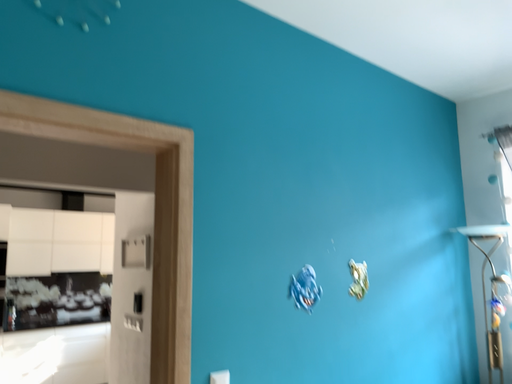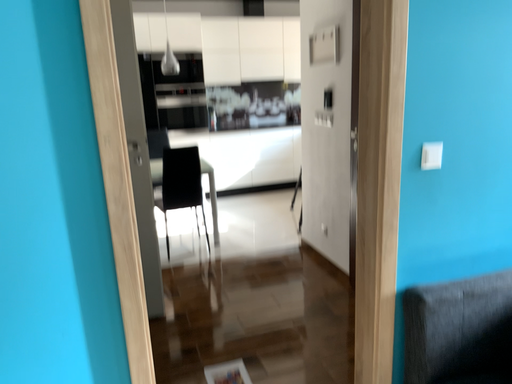
Question: Which way did the camera rotate in the video?

Choices:
 (A) rotated upward
 (B) rotated downward

Answer: (B)